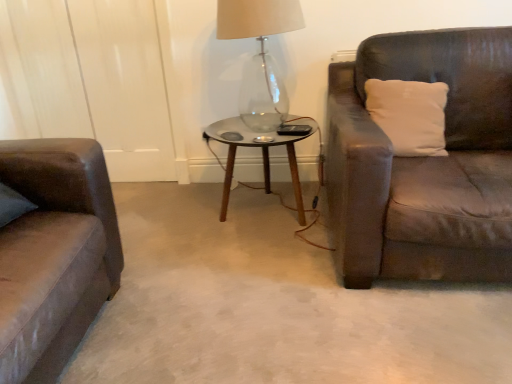
Question: Does transparent glass coffee table at center have a larger size compared to transparent glass table lamp at center?

Choices:
 (A) yes
 (B) no

Answer: (A)

Question: Considering the relative positions of transparent glass coffee table at center and transparent glass table lamp at center in the image provided, is transparent glass coffee table at center to the left of transparent glass table lamp at center from the viewer's perspective?

Choices:
 (A) no
 (B) yes

Answer: (A)

Question: Considering the relative sizes of transparent glass coffee table at center and transparent glass table lamp at center in the image provided, is transparent glass coffee table at center thinner than transparent glass table lamp at center?

Choices:
 (A) no
 (B) yes

Answer: (A)

Question: Is transparent glass coffee table at center at the right side of transparent glass table lamp at center?

Choices:
 (A) no
 (B) yes

Answer: (B)

Question: Is transparent glass coffee table at center oriented towards transparent glass table lamp at center?

Choices:
 (A) no
 (B) yes

Answer: (A)

Question: From the image's perspective, is transparent glass coffee table at center under transparent glass table lamp at center?

Choices:
 (A) no
 (B) yes

Answer: (B)

Question: Is transparent glass coffee table at center further to camera compared to white soft pillow at right?

Choices:
 (A) yes
 (B) no

Answer: (A)

Question: Considering the relative sizes of transparent glass coffee table at center and white soft pillow at right in the image provided, is transparent glass coffee table at center taller than white soft pillow at right?

Choices:
 (A) yes
 (B) no

Answer: (A)

Question: Is transparent glass coffee table at center positioned beyond the bounds of white soft pillow at right?

Choices:
 (A) yes
 (B) no

Answer: (A)

Question: Is transparent glass coffee table at center positioned with its back to white soft pillow at right?

Choices:
 (A) yes
 (B) no

Answer: (B)

Question: Is the surface of transparent glass coffee table at center in direct contact with white soft pillow at right?

Choices:
 (A) yes
 (B) no

Answer: (B)

Question: Can you confirm if transparent glass coffee table at center is positioned to the left of white soft pillow at right?

Choices:
 (A) no
 (B) yes

Answer: (B)

Question: Would you say transparent glass table lamp at center is a long distance from white soft pillow at right?

Choices:
 (A) no
 (B) yes

Answer: (A)